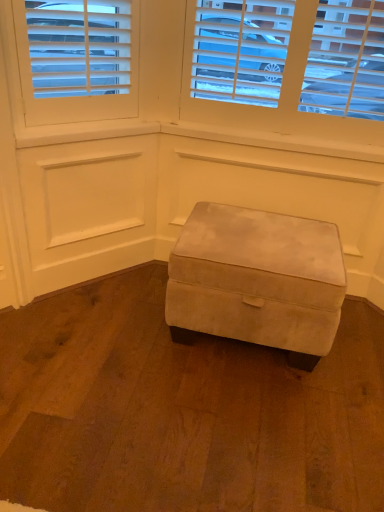
Describe the element at coordinates (258, 280) in the screenshot. This screenshot has width=384, height=512. I see `beige suede ottoman at center` at that location.

Where is `beige suede ottoman at center`? beige suede ottoman at center is located at coordinates (258, 280).

Locate an element on the screen. This screenshot has height=512, width=384. beige suede ottoman at center is located at coordinates (258, 280).